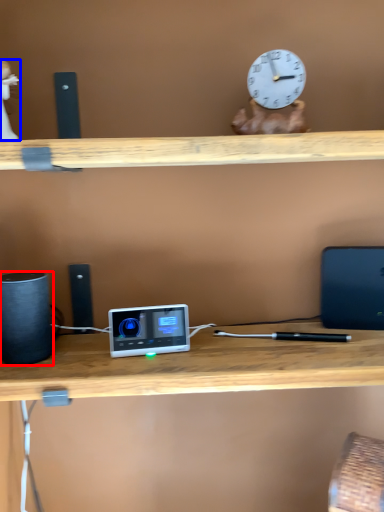
Question: Which point is further to the camera, speaker (highlighted by a red box) or toy (highlighted by a blue box)?

Choices:
 (A) speaker
 (B) toy

Answer: (A)